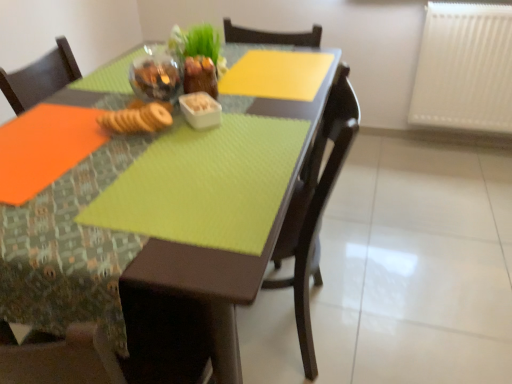
Question: Is matte brown chair at center outside white plastic radiator at upper right?

Choices:
 (A) no
 (B) yes

Answer: (B)

Question: Does matte brown chair at center have a greater width compared to white plastic radiator at upper right?

Choices:
 (A) no
 (B) yes

Answer: (B)

Question: Considering the relative sizes of matte brown chair at center and white plastic radiator at upper right in the image provided, is matte brown chair at center shorter than white plastic radiator at upper right?

Choices:
 (A) no
 (B) yes

Answer: (A)

Question: Is matte brown chair at center at the left side of white plastic radiator at upper right?

Choices:
 (A) yes
 (B) no

Answer: (A)

Question: From a real-world perspective, is matte brown chair at center below white plastic radiator at upper right?

Choices:
 (A) yes
 (B) no

Answer: (A)

Question: Considering their positions, is white plastic radiator at upper right located in front of or behind white plastic container at center, the 1th tableware when ordered from right to left?

Choices:
 (A) behind
 (B) front

Answer: (A)

Question: From a real-world perspective, relative to white plastic container at center, which is counted as the 2th tableware, starting from the left, is white plastic radiator at upper right vertically above or below?

Choices:
 (A) above
 (B) below

Answer: (B)

Question: In terms of height, does white plastic radiator at upper right look taller or shorter compared to white plastic container at center, the 1th tableware when ordered from right to left?

Choices:
 (A) tall
 (B) short

Answer: (A)

Question: Is point (475, 97) closer or farther from the camera than point (202, 94)?

Choices:
 (A) closer
 (B) farther

Answer: (B)

Question: Is matte brown chair at center wider or thinner than brown crumbly biscuit at center?

Choices:
 (A) wide
 (B) thin

Answer: (A)

Question: Is point (344, 102) positioned closer to the camera than point (161, 112)?

Choices:
 (A) farther
 (B) closer

Answer: (A)

Question: Is matte brown chair at center in front of or behind brown crumbly biscuit at center in the image?

Choices:
 (A) behind
 (B) front

Answer: (B)

Question: From a real-world perspective, is matte brown chair at center above or below brown crumbly biscuit at center?

Choices:
 (A) above
 (B) below

Answer: (B)

Question: Looking at their shapes, would you say matte brown chair at center is wider or thinner than translucent glass bowl at upper center, the second tableware viewed from the right?

Choices:
 (A) wide
 (B) thin

Answer: (A)

Question: In terms of size, does matte brown chair at center appear bigger or smaller than translucent glass bowl at upper center, the second tableware viewed from the right?

Choices:
 (A) big
 (B) small

Answer: (A)